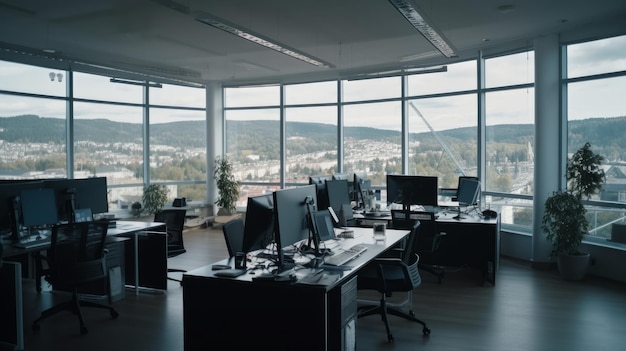
Identify the location of back of computer at desk in foreground. This screenshot has height=351, width=626. (284, 204), (293, 234).